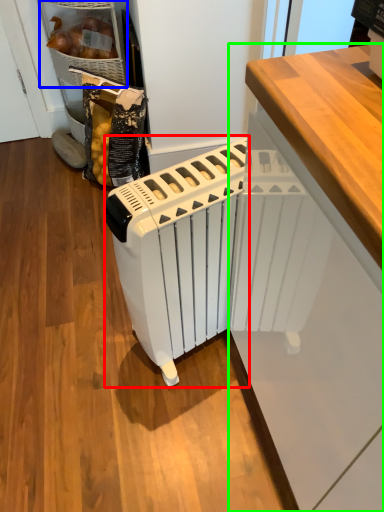
Question: Which object is the farthest from home appliance (highlighted by a red box)? Choose among these: cabinetry (highlighted by a blue box) or cabinetry (highlighted by a green box).

Choices:
 (A) cabinetry
 (B) cabinetry

Answer: (A)